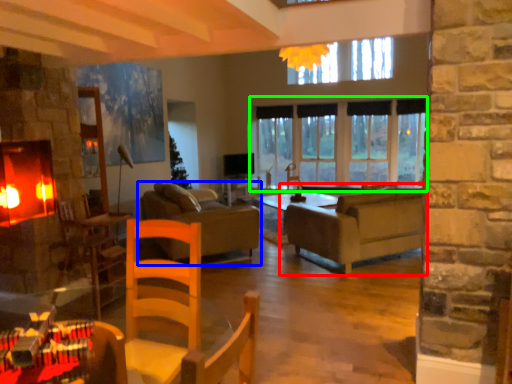
Question: Which object is positioned closest to studio couch (highlighted by a red box)? Select from studio couch (highlighted by a blue box) and window (highlighted by a green box).

Choices:
 (A) studio couch
 (B) window

Answer: (B)